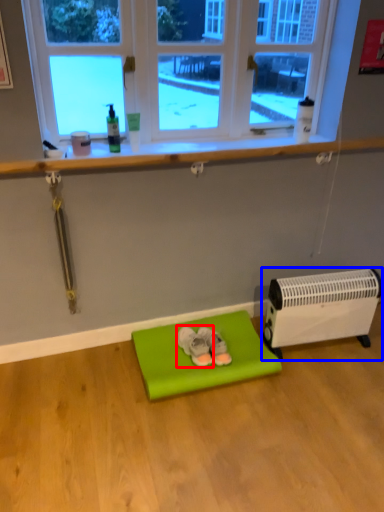
Question: Which object is closer to the camera taking this photo, footwear (highlighted by a red box) or heater (highlighted by a blue box)?

Choices:
 (A) footwear
 (B) heater

Answer: (B)